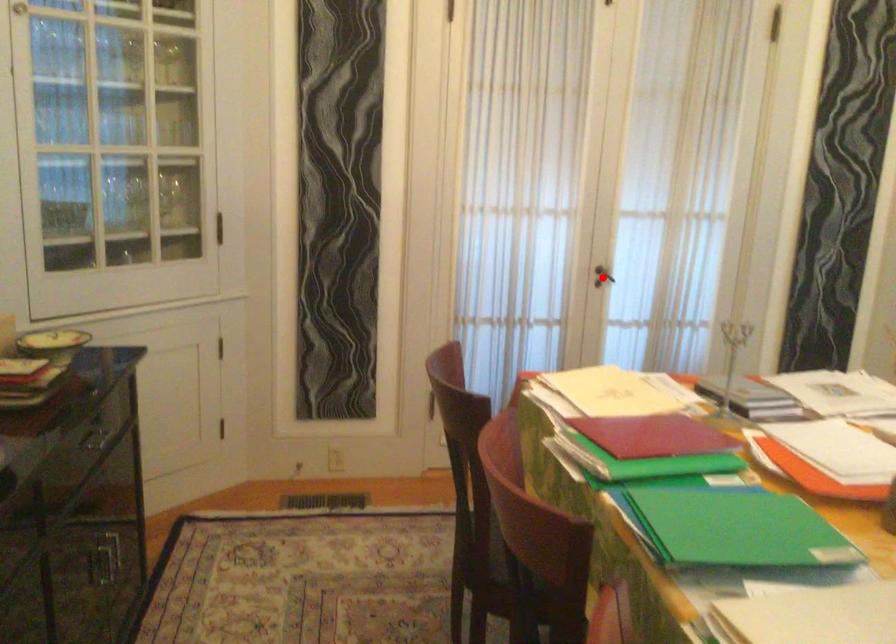
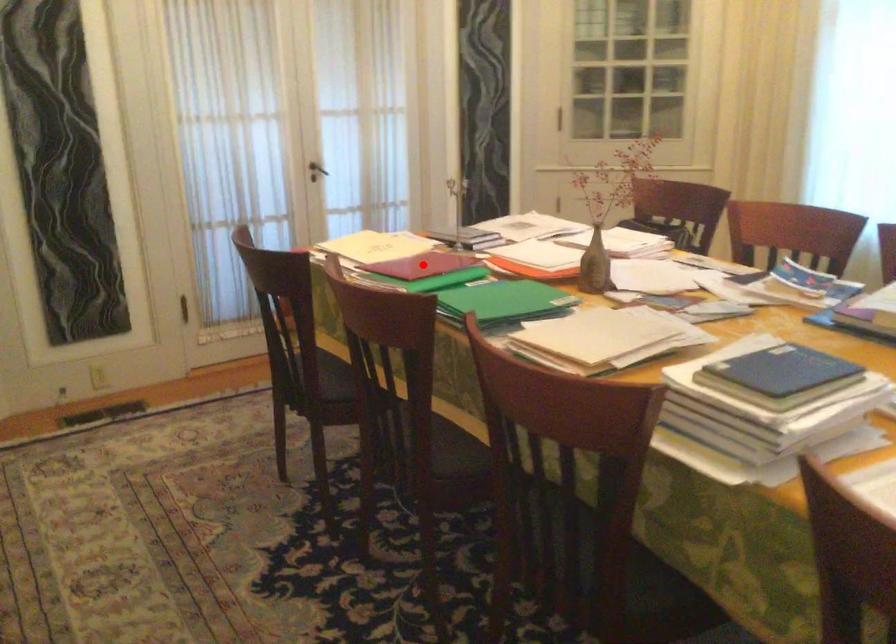
I am providing you with two images of the same scene from different viewpoints. A red point is marked on the first image and another point is marked on the second image. Does the point marked in image1 correspond to the same location as the one in image2?

No